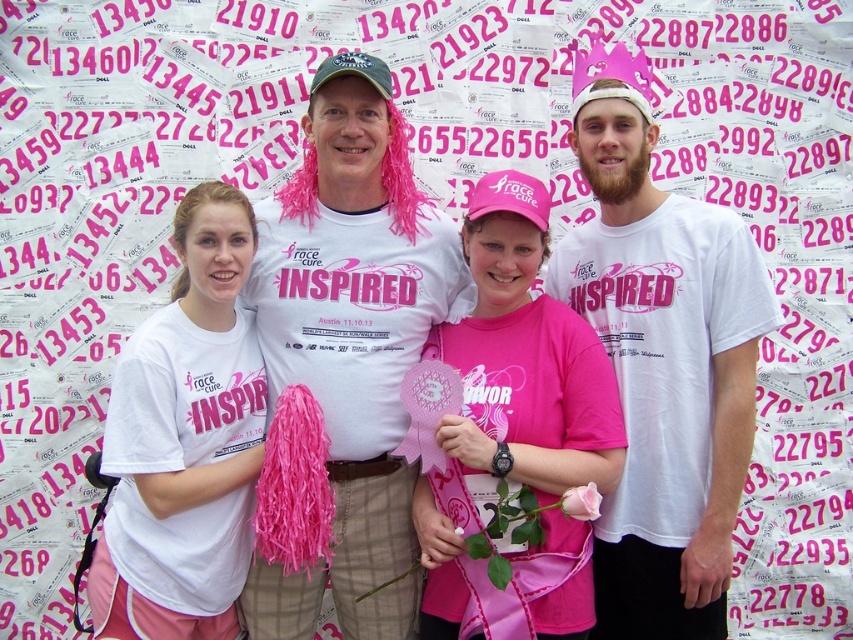
Question: Which is nearer to the white matte t-shirt at center?

Choices:
 (A) matte white shirt at center
 (B) pink matte shirt at center

Answer: (A)

Question: Is pink matte shirt at center bigger than white matte t-shirt at center?

Choices:
 (A) no
 (B) yes

Answer: (B)

Question: Which of the following is the farthest from the observer?

Choices:
 (A) (581, 275)
 (B) (519, 584)

Answer: (A)

Question: Is white t-shirt at center positioned at the back of pink matte shirt at center?

Choices:
 (A) yes
 (B) no

Answer: (A)

Question: Does white t-shirt at center have a lesser width compared to pink matte shirt at center?

Choices:
 (A) yes
 (B) no

Answer: (B)

Question: Which point is closer to the camera taking this photo?

Choices:
 (A) (476, 568)
 (B) (200, 433)

Answer: (A)